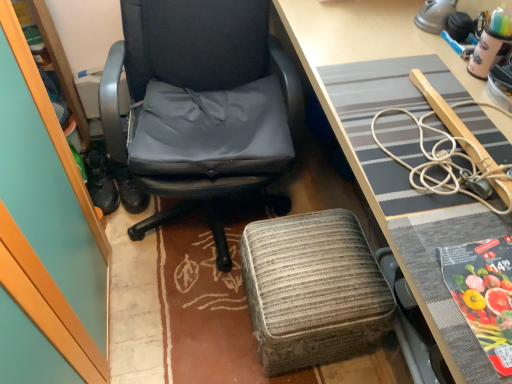
What do you see at coordinates (373, 160) in the screenshot?
I see `textured gray desk mat at center` at bounding box center [373, 160].

Measure the distance between black rubber shoes at left and camera.

black rubber shoes at left and camera are 1.65 meters apart from each other.

This screenshot has height=384, width=512. What do you see at coordinates (483, 293) in the screenshot?
I see `printed paper at lower right` at bounding box center [483, 293].

I want to click on matte black office chair at center, so click(199, 107).

Where is `textured gray desk mat at center`? textured gray desk mat at center is located at coordinates (373, 160).

Considering the sizes of objects printed paper at lower right and black rubber shoes at left in the image provided, who is taller, printed paper at lower right or black rubber shoes at left?

black rubber shoes at left is taller.

This screenshot has height=384, width=512. I want to click on paperback book that appears on the right of black rubber shoes at left, so click(x=483, y=293).

Is point (501, 334) more distant than point (94, 150)?

No, it is not.

Is printed paper at lower right to the left or to the right of black rubber shoes at left in the image?

From the image, it's evident that printed paper at lower right is to the right of black rubber shoes at left.

Looking at this image, does textured gray desk mat at center come behind black rubber shoes at left?

No, it is not.

Considering the relative sizes of textured gray desk mat at center and black rubber shoes at left in the image provided, is textured gray desk mat at center smaller than black rubber shoes at left?

No.

From the image's perspective, is textured gray desk mat at center located above or below black rubber shoes at left?

From the image's perspective, textured gray desk mat at center appears above black rubber shoes at left.

Is textured gray desk mat at center far away from black rubber shoes at left?

Yes.

From the image's perspective, which is above, textured gray desk mat at center or woven fabric stool at lower center?

textured gray desk mat at center appears higher in the image.

This screenshot has height=384, width=512. What are the coordinates of `stool lying on the left of textured gray desk mat at center` in the screenshot? It's located at (313, 290).

Considering the sizes of textured gray desk mat at center and woven fabric stool at lower center in the image, is textured gray desk mat at center taller or shorter than woven fabric stool at lower center?

textured gray desk mat at center is taller than woven fabric stool at lower center.

Does matte black office chair at center touch printed paper at lower right?

No, matte black office chair at center is not touching printed paper at lower right.

Considering the sizes of objects matte black office chair at center and printed paper at lower right in the image provided, who is shorter, matte black office chair at center or printed paper at lower right?

printed paper at lower right.

Can you confirm if matte black office chair at center is bigger than printed paper at lower right?

Indeed, matte black office chair at center has a larger size compared to printed paper at lower right.

Could you tell me if matte black office chair at center is turned towards printed paper at lower right?

No, matte black office chair at center is not aimed at printed paper at lower right.

Between textured gray desk mat at center and printed paper at lower right, which one has larger width?

textured gray desk mat at center is wider.

Is textured gray desk mat at center completely or partially outside of printed paper at lower right?

Yes, textured gray desk mat at center is not within printed paper at lower right.

Is textured gray desk mat at center oriented towards printed paper at lower right?

Yes, textured gray desk mat at center is facing printed paper at lower right.

From a real-world perspective, between textured gray desk mat at center and printed paper at lower right, who is vertically higher?

printed paper at lower right, from a real-world perspective.

Between woven fabric stool at lower center and textured gray desk mat at center, which one has smaller size?

woven fabric stool at lower center is smaller.

Consider the image. Can you see woven fabric stool at lower center touching textured gray desk mat at center?

woven fabric stool at lower center is not next to textured gray desk mat at center, and they're not touching.

Looking at this image, from a real-world perspective, between woven fabric stool at lower center and textured gray desk mat at center, who is vertically higher?

textured gray desk mat at center, from a real-world perspective.

Does woven fabric stool at lower center have a greater width compared to textured gray desk mat at center?

No, woven fabric stool at lower center is not wider than textured gray desk mat at center.

Which is in front, black rubber shoes at left or matte black office chair at center?

matte black office chair at center is in front.

Considering the sizes of black rubber shoes at left and matte black office chair at center in the image, is black rubber shoes at left wider or thinner than matte black office chair at center?

Clearly, black rubber shoes at left has less width compared to matte black office chair at center.

Image resolution: width=512 pixels, height=384 pixels. Find the location of `chair above the black rubber shoes at left (from the image's perspective)`. chair above the black rubber shoes at left (from the image's perspective) is located at coordinates (199, 107).

Is black rubber shoes at left positioned beyond the bounds of matte black office chair at center?

Indeed, black rubber shoes at left is completely outside matte black office chair at center.

Image resolution: width=512 pixels, height=384 pixels. What are the coordinates of `footwear behind the printed paper at lower right` in the screenshot? It's located at (100, 179).

Identify the location of desk above the black rubber shoes at left (from the image's perspective). Image resolution: width=512 pixels, height=384 pixels. (373, 160).

Estimate the real-world distances between objects in this image. Which object is closer to black rubber shoes at left, printed paper at lower right or woven fabric stool at lower center?

Based on the image, woven fabric stool at lower center appears to be nearer to black rubber shoes at left.

When comparing their distances from textured gray desk mat at center, does black rubber shoes at left or printed paper at lower right seem further?

The object further to textured gray desk mat at center is black rubber shoes at left.

Based on their spatial positions, is textured gray desk mat at center or black rubber shoes at left further from woven fabric stool at lower center?

black rubber shoes at left lies further to woven fabric stool at lower center than the other object.

Looking at the image, which one is located closer to matte black office chair at center, textured gray desk mat at center or printed paper at lower right?

The object closer to matte black office chair at center is textured gray desk mat at center.

Considering their positions, is textured gray desk mat at center positioned closer to black rubber shoes at left than woven fabric stool at lower center?

Based on the image, woven fabric stool at lower center appears to be nearer to black rubber shoes at left.

Based on their spatial positions, is matte black office chair at center or printed paper at lower right closer to woven fabric stool at lower center?

matte black office chair at center is closer to woven fabric stool at lower center.

When comparing their distances from black rubber shoes at left, does printed paper at lower right or textured gray desk mat at center seem closer?

The object closer to black rubber shoes at left is textured gray desk mat at center.

Based on their spatial positions, is woven fabric stool at lower center or textured gray desk mat at center further from black rubber shoes at left?

textured gray desk mat at center.

Where is `stool located between black rubber shoes at left and printed paper at lower right in the left-right direction`? This screenshot has height=384, width=512. stool located between black rubber shoes at left and printed paper at lower right in the left-right direction is located at coordinates click(313, 290).

This screenshot has width=512, height=384. Identify the location of chair between textured gray desk mat at center and woven fabric stool at lower center along the z-axis. (199, 107).

Find the location of a particular element. The image size is (512, 384). chair between black rubber shoes at left and printed paper at lower right is located at coordinates (199, 107).

You are a GUI agent. You are given a task and a screenshot of the screen. Output one action in this format:
    pyautogui.click(x=<x>, y=<y>)
    Task: Click on the paperback book between textured gray desk mat at center and black rubber shoes at left in the front-back direction
    
    Given the screenshot: What is the action you would take?
    pyautogui.click(x=483, y=293)